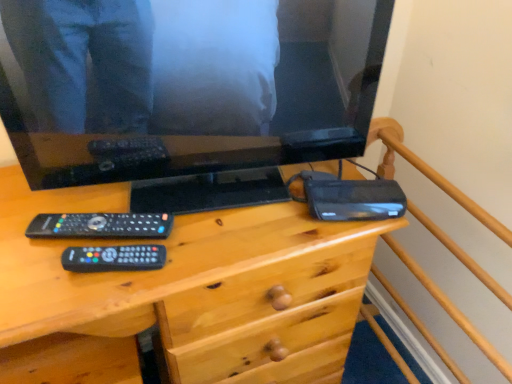
This screenshot has height=384, width=512. What are the coordinates of `black glossy television at upper center` in the screenshot? It's located at (193, 90).

What do you see at coordinates (426, 173) in the screenshot? I see `wooden bed frame at upper right` at bounding box center [426, 173].

Describe the element at coordinates (354, 199) in the screenshot. I see `black matte router at right` at that location.

This screenshot has height=384, width=512. In order to click on black matte router at right in this screenshot , I will do `click(354, 199)`.

Locate an element on the screen. This screenshot has height=384, width=512. black glossy television at upper center is located at coordinates (193, 90).

From a real-world perspective, which is physically below, wooden desk at center or black matte router at right?

wooden desk at center, from a real-world perspective.

How different are the orientations of wooden desk at center and black matte router at right in degrees?

17 degrees separate the facing orientations of wooden desk at center and black matte router at right.

Considering the sizes of objects wooden desk at center and black matte router at right in the image provided, who is thinner, wooden desk at center or black matte router at right?

black matte router at right is thinner.

Between point (293, 226) and point (358, 188), which one is positioned in front?

The point (293, 226) is more forward.

Would you say wooden bed frame at upper right is outside wooden desk at center?

Yes, wooden bed frame at upper right is not within wooden desk at center.

Is wooden bed frame at upper right to the right of wooden desk at center from the viewer's perspective?

Yes.

Considering the points (452, 319) and (306, 351), which point is in front, point (452, 319) or point (306, 351)?

The point (452, 319) is in front.

Would you say wooden bed frame at upper right is a long distance from wooden desk at center?

No, wooden bed frame at upper right is not far from wooden desk at center.

Considering the relative sizes of wooden bed frame at upper right and black matte router at right in the image provided, is wooden bed frame at upper right smaller than black matte router at right?

Actually, wooden bed frame at upper right might be larger than black matte router at right.

Which is behind, point (464, 258) or point (399, 195)?

The point (464, 258) is more distant.

From a real-world perspective, is wooden bed frame at upper right physically below black matte router at right?

Yes, from a real-world perspective, wooden bed frame at upper right is under black matte router at right.

Is wooden bed frame at upper right far away from black matte router at right?

wooden bed frame at upper right is near black matte router at right, not far away.

From the image's perspective, is wooden bed frame at upper right beneath black glossy television at upper center?

Yes, from the image's perspective, wooden bed frame at upper right is beneath black glossy television at upper center.

How much distance is there between wooden bed frame at upper right and black glossy television at upper center?

They are 15.28 inches apart.

Is wooden bed frame at upper right positioned with its back to black glossy television at upper center?

No, wooden bed frame at upper right's orientation is not away from black glossy television at upper center.

What's the angular difference between wooden bed frame at upper right and black glossy television at upper center's facing directions?

There is a 77.9-degree angle between the facing directions of wooden bed frame at upper right and black glossy television at upper center.

Is point (27, 341) positioned after point (465, 265)?

That is False.

Between wooden desk at center and wooden bed frame at upper right, which one has larger size?

wooden desk at center.

Which object is further away from the camera, wooden desk at center or wooden bed frame at upper right?

wooden bed frame at upper right is more distant.

Looking at this image, from the image's perspective, does wooden desk at center appear lower than wooden bed frame at upper right?

No.

Considering the positions of point (87, 149) and point (315, 190), is point (87, 149) closer or farther from the camera than point (315, 190)?

Point (87, 149).

Would you say black glossy television at upper center is outside black matte router at right?

Absolutely, black glossy television at upper center is external to black matte router at right.

Which is more to the right, black glossy television at upper center or black matte router at right?

black matte router at right is more to the right.

Is black matte router at right at the left side of wooden desk at center?

Incorrect, black matte router at right is not on the left side of wooden desk at center.

Between black matte router at right and wooden desk at center, which one has smaller size?

With smaller size is black matte router at right.

From the image's perspective, which is above, black matte router at right or wooden desk at center?

black matte router at right is shown above in the image.

Does black matte router at right come in front of wooden desk at center?

No, black matte router at right is behind wooden desk at center.

Find the location of a particular element. Image resolution: width=512 pixels, height=384 pixels. desk that is below the black matte router at right (from the image's perspective) is located at coordinates (188, 290).

Identify the location of bed frame that appears behind the wooden desk at center. The width and height of the screenshot is (512, 384). (426, 173).

Estimate the real-world distances between objects in this image. Which object is closer to wooden bed frame at upper right, black glossy television at upper center or wooden desk at center?

wooden desk at center is positioned closer to the anchor wooden bed frame at upper right.

Based on their spatial positions, is black matte router at right or wooden desk at center further from black glossy television at upper center?

The object further to black glossy television at upper center is black matte router at right.

From the image, which object appears to be nearer to wooden bed frame at upper right, black matte router at right or wooden desk at center?

black matte router at right lies closer to wooden bed frame at upper right than the other object.

Based on the photo, considering their positions, is wooden bed frame at upper right positioned further to black matte router at right than wooden desk at center?

wooden desk at center.

Looking at the image, which one is located closer to wooden bed frame at upper right, wooden desk at center or black glossy television at upper center?

The object closer to wooden bed frame at upper right is wooden desk at center.

From the image, which object appears to be nearer to black glossy television at upper center, wooden bed frame at upper right or black matte router at right?

Among the two, black matte router at right is located nearer to black glossy television at upper center.

Estimate the real-world distances between objects in this image. Which object is closer to wooden bed frame at upper right, wooden desk at center or black matte router at right?

black matte router at right lies closer to wooden bed frame at upper right than the other object.

From the image, which object appears to be nearer to black glossy television at upper center, wooden desk at center or wooden bed frame at upper right?

The object closer to black glossy television at upper center is wooden desk at center.

Where is `gadget between wooden desk at center and wooden bed frame at upper right from left to right`? This screenshot has width=512, height=384. gadget between wooden desk at center and wooden bed frame at upper right from left to right is located at coordinates (354, 199).

At what (x,y) coordinates should I click in order to perform the action: click on gadget between black glossy television at upper center and wooden desk at center in the up-down direction. Please return your answer as a coordinate pair (x, y). The width and height of the screenshot is (512, 384). Looking at the image, I should click on (354, 199).

Find the location of a particular element. Image resolution: width=512 pixels, height=384 pixels. gadget that lies between black glossy television at upper center and wooden bed frame at upper right from top to bottom is located at coordinates (354, 199).

Locate an element on the screen. This screenshot has height=384, width=512. television situated between wooden desk at center and wooden bed frame at upper right from left to right is located at coordinates (193, 90).